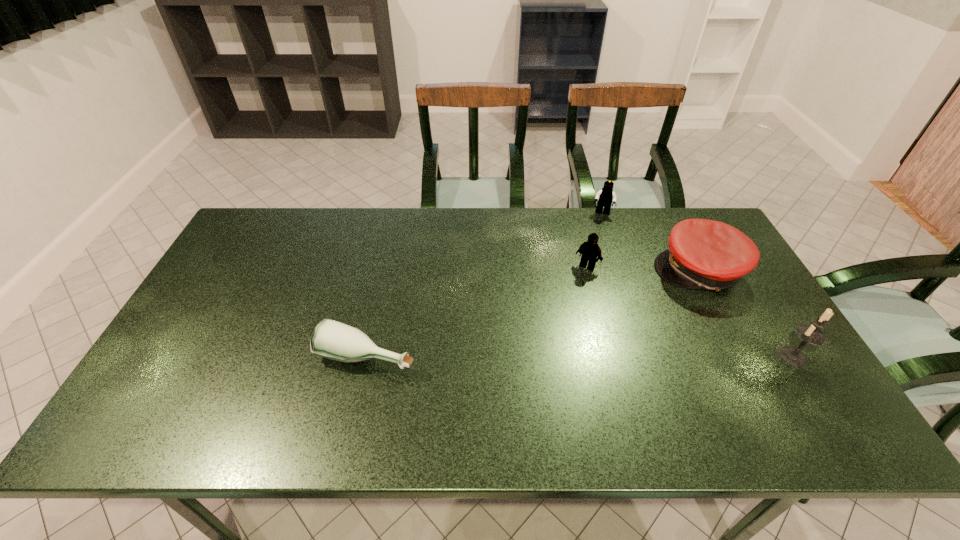
The height and width of the screenshot is (540, 960). What are the coordinates of `vacant space on the desktop that is between the shortest object and the tallest object and is positioned on the front-facing side of the cap` in the screenshot? It's located at (605, 356).

This screenshot has height=540, width=960. I want to click on free space on the desktop that is between the shortest object and the tallest object and is positioned on the face of the nearer Lego, so click(532, 356).

In order to click on free space on the desktop that is between the bottle and the candle holder and is positioned on the front-facing side of the third object from left to right in this screenshot , I will do `click(588, 356)`.